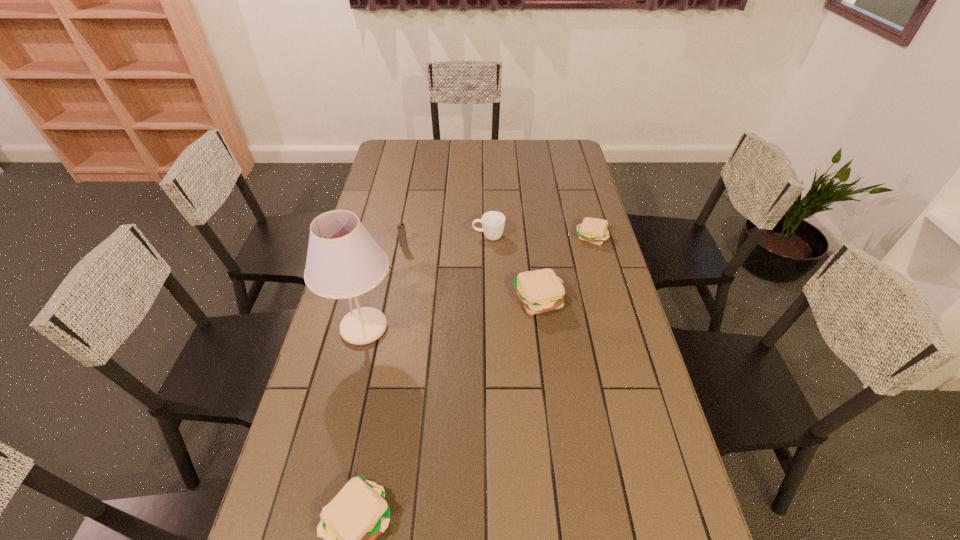
Where is `free location that satisfies the following two spatial constraints: 1. on the back side of the igniter; 2. on the right side of the rightmost object`? The height and width of the screenshot is (540, 960). free location that satisfies the following two spatial constraints: 1. on the back side of the igniter; 2. on the right side of the rightmost object is located at coordinates (405, 237).

What are the coordinates of `blank space that satisfies the following two spatial constraints: 1. on the front side of the rightmost patty; 2. with the handle on the side of the third object from right to left` in the screenshot? It's located at (590, 237).

Identify the location of free spot that satisfies the following two spatial constraints: 1. on the back side of the farthest patty; 2. on the left side of the lampshade. (386, 237).